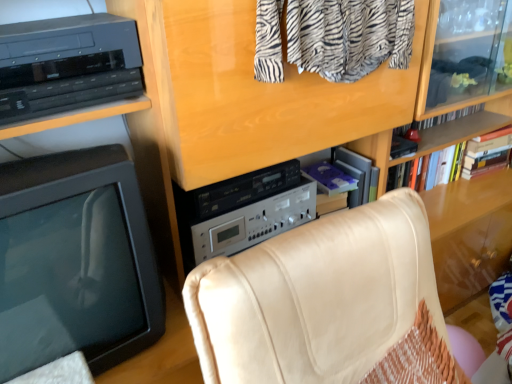
What do you see at coordinates (330, 178) in the screenshot? The width and height of the screenshot is (512, 384). I see `purple matte book at center, the first book when ordered from left to right` at bounding box center [330, 178].

This screenshot has height=384, width=512. Describe the element at coordinates (426, 170) in the screenshot. I see `hardcover book at upper right, arranged as the 3th book when viewed from the left` at that location.

What do you see at coordinates (71, 72) in the screenshot?
I see `black plastic shelf at upper left` at bounding box center [71, 72].

What is the approximate width of black plastic shelf at upper left?

black plastic shelf at upper left is 27.89 centimeters wide.

What do you see at coordinates (75, 262) in the screenshot? The image size is (512, 384). I see `black plastic television at left` at bounding box center [75, 262].

What is the approximate width of silver metallic amplifier at center?

silver metallic amplifier at center is 10.70 inches in width.

This screenshot has width=512, height=384. What are the coordinates of `purple matte book at center, the first book when ordered from left to right` in the screenshot? It's located at (330, 178).

Based on the photo, considering the relative sizes of purple plastic book at center right, which is the 2th book from left to right, and beige leather chair at center in the image provided, is purple plastic book at center right, which is the 2th book from left to right, bigger than beige leather chair at center?

Actually, purple plastic book at center right, which is the 2th book from left to right, might be smaller than beige leather chair at center.

Is purple plastic book at center right, which is the 2th book from left to right, at the left side of beige leather chair at center?

No.

Would you say purple plastic book at center right, the second book in the right-to-left sequence, is inside or outside beige leather chair at center?

purple plastic book at center right, the second book in the right-to-left sequence, is not enclosed by beige leather chair at center.

From a real-world perspective, between purple plastic book at center right, the second book in the right-to-left sequence, and beige leather chair at center, who is vertically higher?

From a 3D spatial view, purple plastic book at center right, the second book in the right-to-left sequence, is above.

Which is closer to the camera, (322, 172) or (139, 301)?

Point (322, 172) is farther from the camera than point (139, 301).

Between purple matte book at center, the first book when ordered from left to right, and black plastic television at left, which one appears on the left side from the viewer's perspective?

Result: black plastic television at left is more to the left.

From a real-world perspective, does purple matte book at center, the first book when ordered from left to right, sit lower than black plastic television at left?

Yes, from a real-world perspective, purple matte book at center, the first book when ordered from left to right, is beneath black plastic television at left.

Is purple matte book at center, which is the third book from right to left, not close to black plastic television at left?

No, purple matte book at center, which is the third book from right to left, is not far from black plastic television at left.

From the image's perspective, is purple plastic book at center right, the second book in the right-to-left sequence, beneath purple matte book at center, which is the third book from right to left?

Yes, from the image's perspective, purple plastic book at center right, the second book in the right-to-left sequence, is beneath purple matte book at center, which is the third book from right to left.

Between purple plastic book at center right, which is the 2th book from left to right, and purple matte book at center, the first book when ordered from left to right, which one has smaller width?

Thinner between the two is purple matte book at center, the first book when ordered from left to right.

Considering the relative positions of purple plastic book at center right, the second book in the right-to-left sequence, and purple matte book at center, which is the third book from right to left, in the image provided, is purple plastic book at center right, the second book in the right-to-left sequence, to the left of purple matte book at center, which is the third book from right to left, from the viewer's perspective?

No.

Considering the sizes of objects purple plastic book at center right, which is the 2th book from left to right, and purple matte book at center, which is the third book from right to left, in the image provided, who is smaller, purple plastic book at center right, which is the 2th book from left to right, or purple matte book at center, which is the third book from right to left,?

purple matte book at center, which is the third book from right to left, is smaller.

Is black plastic shelf at upper left facing towards black plastic television at left?

No, black plastic shelf at upper left is not oriented towards black plastic television at left.

Which of these two, black plastic shelf at upper left or black plastic television at left, stands taller?

black plastic television at left is taller.

Is black plastic shelf at upper left surrounding black plastic television at left?

That's incorrect, black plastic television at left is not inside black plastic shelf at upper left.

From a real-world perspective, which is physically below, black plastic shelf at upper left or black plastic television at left?

black plastic television at left.

In the scene shown: Is purple matte book at center, the first book when ordered from left to right, turned away from black plastic shelf at upper left?

No, black plastic shelf at upper left is not at the back of purple matte book at center, the first book when ordered from left to right.

From the image's perspective, is purple matte book at center, which is the third book from right to left, below black plastic shelf at upper left?

Correct, purple matte book at center, which is the third book from right to left, appears lower than black plastic shelf at upper left in the image.

Is purple matte book at center, the first book when ordered from left to right, closer to camera compared to black plastic shelf at upper left?

No, purple matte book at center, the first book when ordered from left to right, is behind black plastic shelf at upper left.

Find the location of a particular element. the 1st book behind the black plastic shelf at upper left, starting your count from the anchor is located at coordinates (330, 178).

Considering the points (240, 186) and (322, 176), which point is in front, point (240, 186) or point (322, 176)?

Point (240, 186)

Is silver metallic amplifier at center next to purple matte book at center, the first book when ordered from left to right, and touching it?

No, silver metallic amplifier at center is not in contact with purple matte book at center, the first book when ordered from left to right.

There is a silver metallic amplifier at center. Find the location of `the 1st book below it (from a real-world perspective)`. the 1st book below it (from a real-world perspective) is located at coordinates [330, 178].

Could you tell me if silver metallic amplifier at center is turned towards purple matte book at center, the first book when ordered from left to right?

No, silver metallic amplifier at center is not aimed at purple matte book at center, the first book when ordered from left to right.

In terms of size, does purple plastic book at center right, the second book in the right-to-left sequence, appear bigger or smaller than hardcover book at upper right, arranged as the 3th book when viewed from the left?

purple plastic book at center right, the second book in the right-to-left sequence, is smaller than hardcover book at upper right, arranged as the 3th book when viewed from the left.

Between purple plastic book at center right, the second book in the right-to-left sequence, and hardcover book at upper right, arranged as the 3th book when viewed from the left, which one appears on the right side from the viewer's perspective?

From the viewer's perspective, hardcover book at upper right, arranged as the 3th book when viewed from the left, appears more on the right side.

Measure the distance between purple plastic book at center right, the second book in the right-to-left sequence, and hardcover book at upper right, arranged as the 3th book when viewed from the left.

purple plastic book at center right, the second book in the right-to-left sequence, is 9.51 inches away from hardcover book at upper right, arranged as the 3th book when viewed from the left.

Is purple plastic book at center right, which is the 2th book from left to right, oriented towards hardcover book at upper right, positioned as the first book in right-to-left order?

No, purple plastic book at center right, which is the 2th book from left to right, is not turned towards hardcover book at upper right, positioned as the first book in right-to-left order.

Image resolution: width=512 pixels, height=384 pixels. I want to click on the 1st book above the beige leather chair at center (from the image's perspective), so [x=345, y=175].

Find the location of `television in front of the purple matte book at center, which is the third book from right to left`. television in front of the purple matte book at center, which is the third book from right to left is located at coordinates (75, 262).

Based on the photo, looking at the image, which one is located further to beige leather chair at center, purple plastic book at center right, the second book in the right-to-left sequence, or black plastic television at left?

Based on the image, purple plastic book at center right, the second book in the right-to-left sequence, appears to be further to beige leather chair at center.

Estimate the real-world distances between objects in this image. Which object is further from purple matte book at center, which is the third book from right to left, black plastic shelf at upper left or purple plastic book at center right, which is the 2th book from left to right?

black plastic shelf at upper left.

Looking at the image, which one is located further to beige leather chair at center, silver metallic amplifier at center or black plastic television at left?

silver metallic amplifier at center is further to beige leather chair at center.

Estimate the real-world distances between objects in this image. Which object is closer to purple plastic book at center right, which is the 2th book from left to right, beige leather chair at center or black plastic television at left?

Based on the image, beige leather chair at center appears to be nearer to purple plastic book at center right, which is the 2th book from left to right.

Looking at the image, which one is located further to silver metallic amplifier at center, purple plastic book at center right, which is the 2th book from left to right, or black plastic television at left?

black plastic television at left is positioned further to the anchor silver metallic amplifier at center.

Consider the image. Based on their spatial positions, is black plastic television at left or beige leather chair at center closer to purple matte book at center, the first book when ordered from left to right?

beige leather chair at center is positioned closer to the anchor purple matte book at center, the first book when ordered from left to right.

Which object lies nearer to the anchor point silver metallic amplifier at center, purple matte book at center, the first book when ordered from left to right, or black plastic television at left?

The object closer to silver metallic amplifier at center is purple matte book at center, the first book when ordered from left to right.

In the scene shown: When comparing their distances from black plastic shelf at upper left, does black plastic television at left or beige leather chair at center seem further?

beige leather chair at center is positioned further to the anchor black plastic shelf at upper left.

Locate an element on the screen. The width and height of the screenshot is (512, 384). amplifier between black plastic television at left and purple plastic book at center right, which is the 2th book from left to right, in the front-back direction is located at coordinates (242, 211).

The width and height of the screenshot is (512, 384). Identify the location of shelf between black plastic television at left and purple matte book at center, which is the third book from right to left, from front to back. (71, 72).

Find the location of `book situated between black plastic shelf at upper left and purple plastic book at center right, which is the 2th book from left to right, from left to right`. book situated between black plastic shelf at upper left and purple plastic book at center right, which is the 2th book from left to right, from left to right is located at coordinates (330, 178).

The image size is (512, 384). Identify the location of chair between black plastic television at left and hardcover book at upper right, arranged as the 3th book when viewed from the left, from left to right. (327, 303).